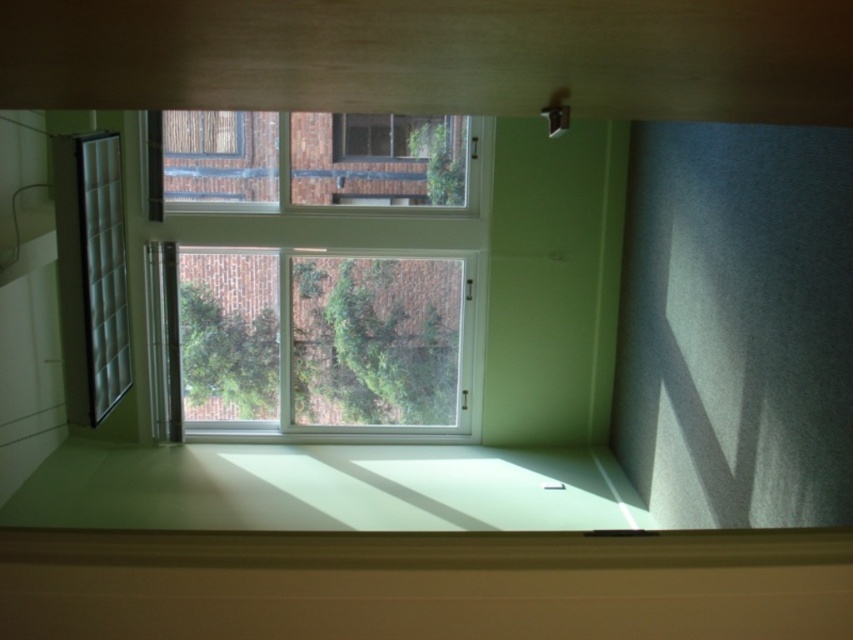
Question: Does white plastic window at center have a lesser width compared to clear glass window at center?

Choices:
 (A) no
 (B) yes

Answer: (B)

Question: Which point is farther to the camera?

Choices:
 (A) clear glass window at center
 (B) white matte curtain at right
 (C) white plastic window at center
 (D) translucent fabric curtain at left

Answer: (C)

Question: Considering the real-world distances, which object is farthest from the clear glass window at center?

Choices:
 (A) translucent fabric curtain at left
 (B) white matte curtain at right
 (C) white plastic window at center

Answer: (B)

Question: Is white matte curtain at right above clear glass window at center?

Choices:
 (A) no
 (B) yes

Answer: (A)

Question: Which of the following is the closest to the observer?

Choices:
 (A) (354, 337)
 (B) (109, 332)

Answer: (B)

Question: Is white matte curtain at right smaller than clear glass window at center?

Choices:
 (A) yes
 (B) no

Answer: (B)